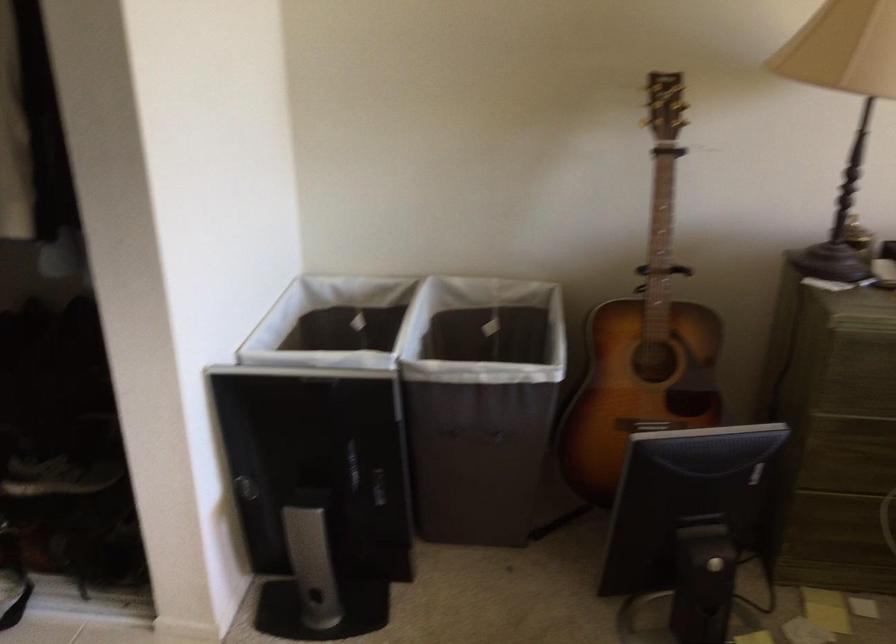
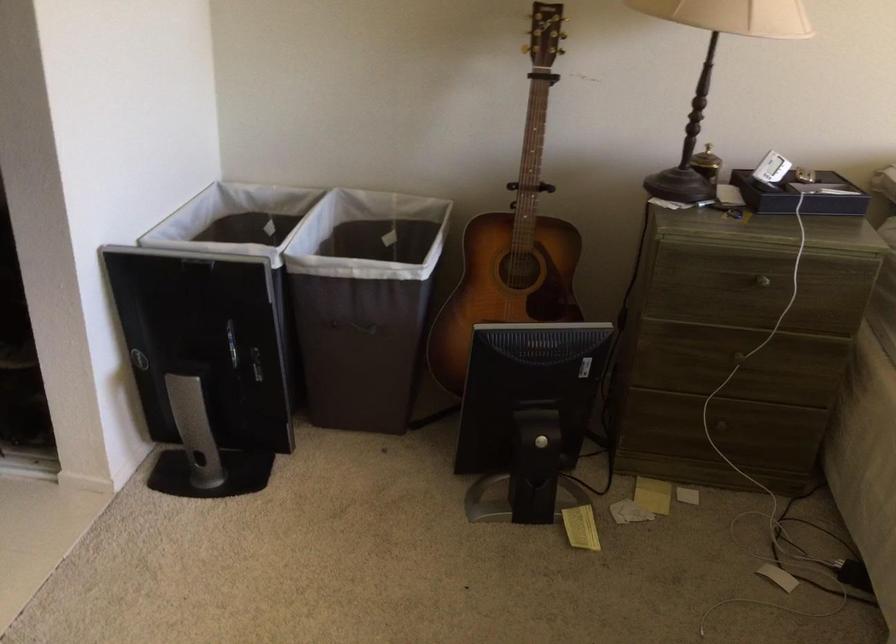
Locate, in the second image, the point that corresponds to point (643, 327) in the first image.

(513, 237)